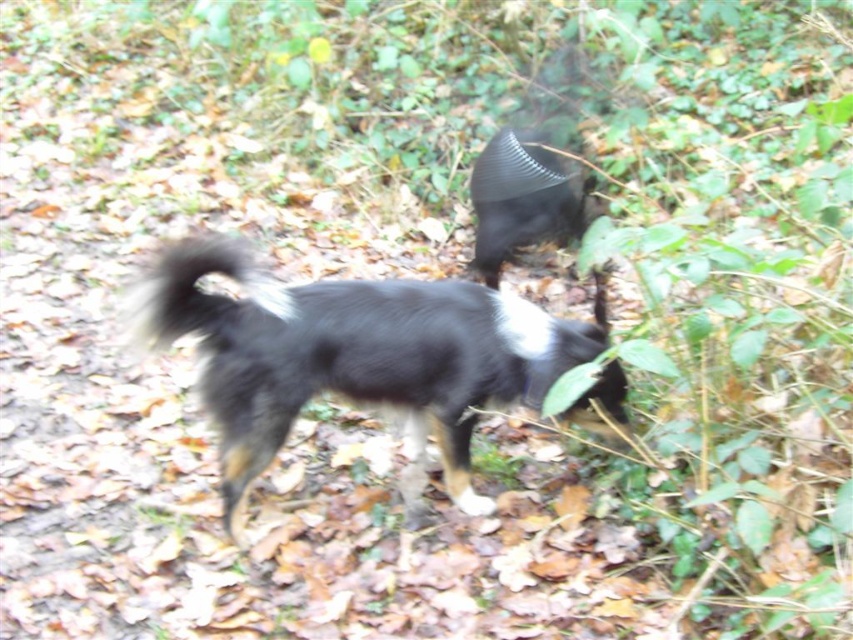
You are a photographer trying to capture both the black fuzzy dog at center and the fluffy black tail at center in a single frame. Given their sizes, which one will occupy more space in your photo?

The black fuzzy dog at center will occupy more space in the photo because its width is larger than that of the fluffy black tail at center.